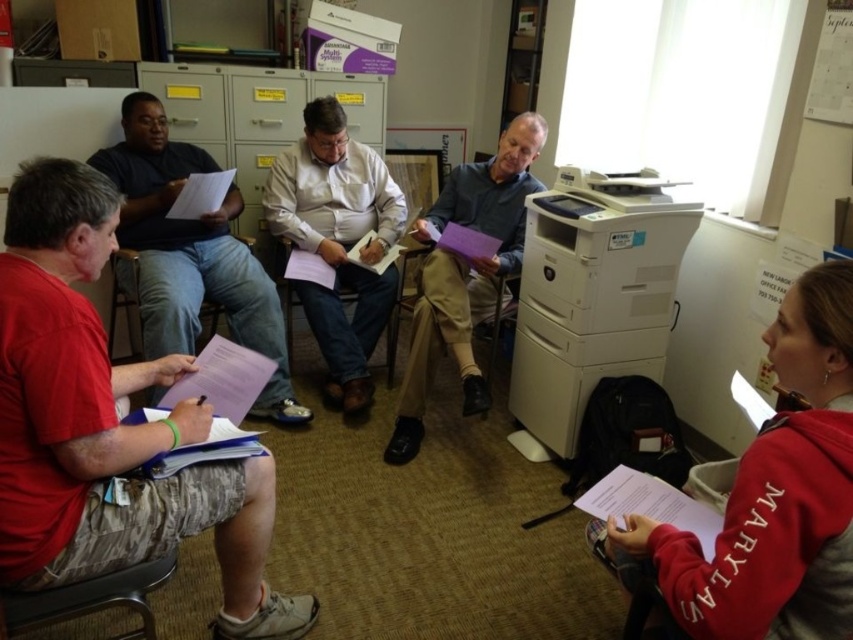
Question: Which object is positioned closest to the matte plastic chair at lower left?

Choices:
 (A) metallic gray chair at lower left
 (B) white matte printer at right

Answer: (A)

Question: Estimate the real-world distances between objects in this image. Which object is farther from the matte paper at left?

Choices:
 (A) camouflage shorts at lower left
 (B) white matte printer at right
 (C) metallic gray chair at lower left
 (D) matte khaki shirt at center

Answer: (C)

Question: Does matte purple folder at center come in front of metallic gray chair at lower left?

Choices:
 (A) yes
 (B) no

Answer: (B)

Question: Is matte paper at left to the left of metallic gray chair at lower left from the viewer's perspective?

Choices:
 (A) yes
 (B) no

Answer: (A)

Question: Which of these objects is positioned farthest from the camouflage shorts at lower left?

Choices:
 (A) brown fabric chair at center
 (B) metallic gray chair at lower left

Answer: (A)

Question: Is camouflage shorts at lower left positioned before metallic gray chair at lower left?

Choices:
 (A) yes
 (B) no

Answer: (A)